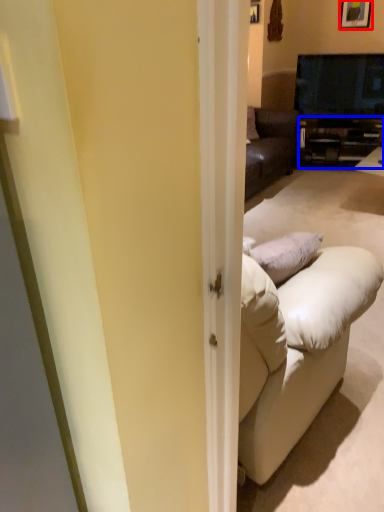
Question: Which object is closer to the camera taking this photo, picture frame (highlighted by a red box) or cabinetry (highlighted by a blue box)?

Choices:
 (A) picture frame
 (B) cabinetry

Answer: (A)